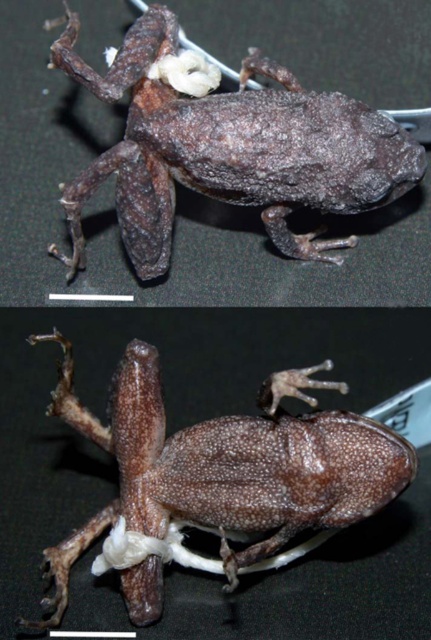
You are a biology student comparing two frog specimens displayed side by side. The first is a fuzzy brown frog at center, and the second is a brown matte frog at center. Based on their appearance, which frog do you think has a larger body size?

The fuzzy brown frog at center is bigger than the brown matte frog at center, so the fuzzy brown frog at center has a larger body size.

You are a biology student comparing two frog specimens displayed side by side. You notice the fuzzy brown frog at center and the brown matte frog at center. Which frog is positioned to the right of the other?

The fuzzy brown frog at center is to the right of the brown matte frog at center.